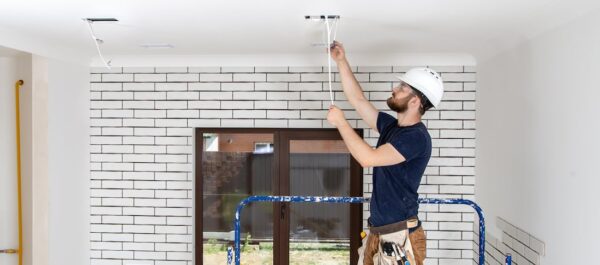
Identify the location of hole in ceiling. This screenshot has width=600, height=265. (320, 15), (103, 20).